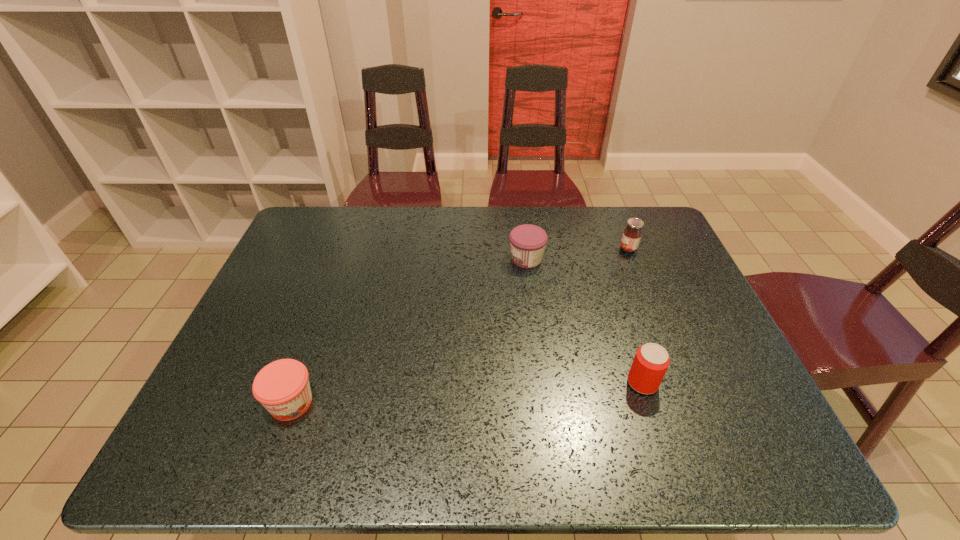
In order to click on free region located 0.170m on the front label of the third object from right to left in this screenshot , I will do `click(452, 259)`.

Where is `free space located on the front label of the third object from right to left`? This screenshot has width=960, height=540. free space located on the front label of the third object from right to left is located at coordinates tap(449, 259).

Where is `free region located 0.060m on the front label of the leftmost object`? The image size is (960, 540). free region located 0.060m on the front label of the leftmost object is located at coordinates (274, 454).

Find the location of a particular element. Image resolution: width=960 pixels, height=540 pixels. object at the left edge is located at coordinates (282, 387).

The width and height of the screenshot is (960, 540). What are the coordinates of `object that is positioned at the right edge` in the screenshot? It's located at (632, 234).

You are a GUI agent. You are given a task and a screenshot of the screen. Output one action in this format:
    pyautogui.click(x=<x>, y=<y>)
    Task: Click on the object positioned at the far right corner
    The image size is (960, 540).
    Given the screenshot: What is the action you would take?
    pyautogui.click(x=632, y=234)

Locate an element on the screen. Image resolution: width=960 pixels, height=540 pixels. vacant space at the far edge of the desktop is located at coordinates (468, 213).

In order to click on free space at the near edge of the desktop in this screenshot , I will do `click(439, 452)`.

I want to click on free space at the left edge of the desktop, so click(x=243, y=416).

Find the location of `vacant space at the right edge of the desktop`. vacant space at the right edge of the desktop is located at coordinates (679, 273).